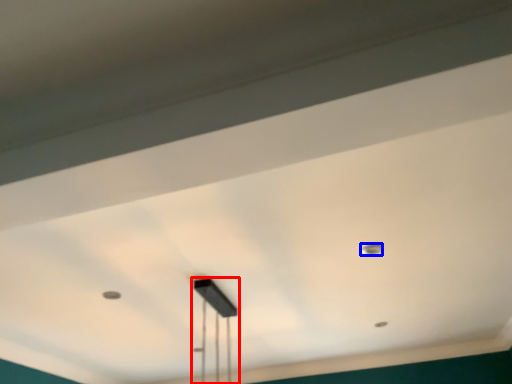
Question: Among these objects, which one is farthest to the camera, lamp (highlighted by a red box) or dot (highlighted by a blue box)?

Choices:
 (A) lamp
 (B) dot

Answer: (B)